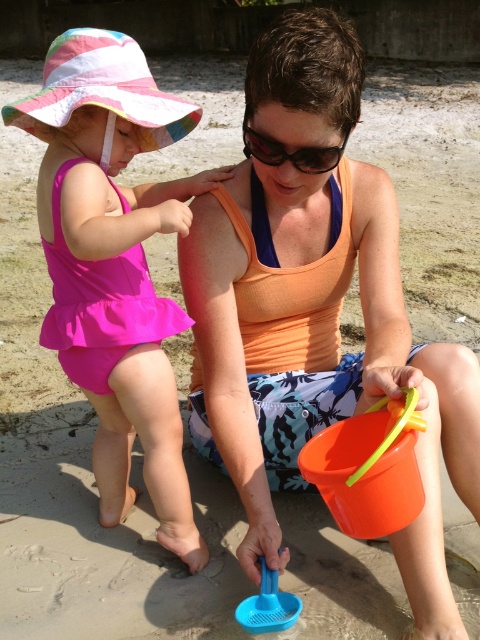
Who is more distant from viewer, (x=444, y=609) or (x=265, y=566)?

The point (x=265, y=566) is behind.

Is point (269, 74) positioned in front of point (260, 556)?

Yes, point (269, 74) is in front of point (260, 556).

Locate an element on the screen. This screenshot has height=640, width=480. orange fabric tank top at center is located at coordinates (317, 355).

At what (x,y) coordinates should I click in order to perform the action: click on orange fabric tank top at center. Please return your answer as a coordinate pair (x, y). The width and height of the screenshot is (480, 640). Looking at the image, I should click on (317, 355).

I want to click on orange fabric tank top at center, so click(x=317, y=355).

Measure the distance between orange fabric tank top at center and camera.

orange fabric tank top at center is 4.84 feet from camera.

Where is `orange fabric tank top at center`? This screenshot has height=640, width=480. orange fabric tank top at center is located at coordinates (317, 355).

Identify the location of orange fabric tank top at center. The image size is (480, 640). (317, 355).

Does point (273, 604) lie in front of point (322, 166)?

No, it is not.

What do you see at coordinates (267, 605) in the screenshot?
I see `blue plastic sieve at lower center` at bounding box center [267, 605].

The image size is (480, 640). What do you see at coordinates (267, 605) in the screenshot?
I see `blue plastic sieve at lower center` at bounding box center [267, 605].

Locate an element on the screen. The width and height of the screenshot is (480, 640). blue plastic sieve at lower center is located at coordinates (267, 605).